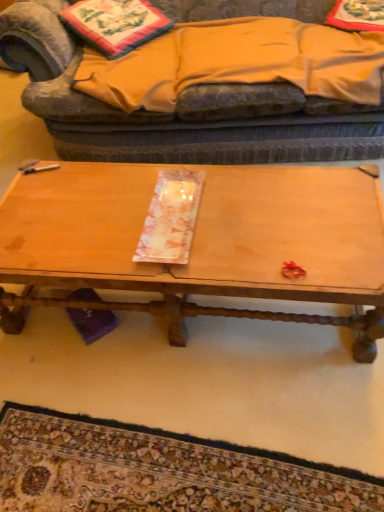
Question: Would you say carpet with intricate patterns at lower center contains wooden tray at center?

Choices:
 (A) no
 (B) yes

Answer: (A)

Question: From a real-world perspective, does carpet with intricate patterns at lower center sit lower than wooden tray at center?

Choices:
 (A) yes
 (B) no

Answer: (A)

Question: Are carpet with intricate patterns at lower center and wooden tray at center located far from each other?

Choices:
 (A) yes
 (B) no

Answer: (B)

Question: Can you confirm if carpet with intricate patterns at lower center is positioned to the left of wooden tray at center?

Choices:
 (A) no
 (B) yes

Answer: (B)

Question: From a real-world perspective, is carpet with intricate patterns at lower center over wooden tray at center?

Choices:
 (A) yes
 (B) no

Answer: (B)

Question: Based on their sizes in the image, would you say wooden tray at center is bigger or smaller than velvet fabric studio couch at upper center?

Choices:
 (A) big
 (B) small

Answer: (B)

Question: From the image's perspective, relative to velvet fabric studio couch at upper center, is wooden tray at center above or below?

Choices:
 (A) below
 (B) above

Answer: (A)

Question: Is wooden tray at center in front of or behind velvet fabric studio couch at upper center in the image?

Choices:
 (A) behind
 (B) front

Answer: (B)

Question: Considering the positions of wooden tray at center and velvet fabric studio couch at upper center in the image, is wooden tray at center wider or thinner than velvet fabric studio couch at upper center?

Choices:
 (A) thin
 (B) wide

Answer: (A)

Question: Is wooden tray at center inside or outside of embroidered fabric pillow at upper left?

Choices:
 (A) outside
 (B) inside

Answer: (A)

Question: From their relative heights in the image, would you say wooden tray at center is taller or shorter than embroidered fabric pillow at upper left?

Choices:
 (A) short
 (B) tall

Answer: (B)

Question: Looking at their shapes, would you say wooden tray at center is wider or thinner than embroidered fabric pillow at upper left?

Choices:
 (A) wide
 (B) thin

Answer: (A)

Question: From a real-world perspective, is wooden tray at center positioned above or below embroidered fabric pillow at upper left?

Choices:
 (A) below
 (B) above

Answer: (A)

Question: Is point (102, 266) positioned closer to the camera than point (172, 481)?

Choices:
 (A) closer
 (B) farther

Answer: (B)

Question: Considering their positions, is wooden tray at center located in front of or behind carpet with intricate patterns at lower center?

Choices:
 (A) front
 (B) behind

Answer: (B)